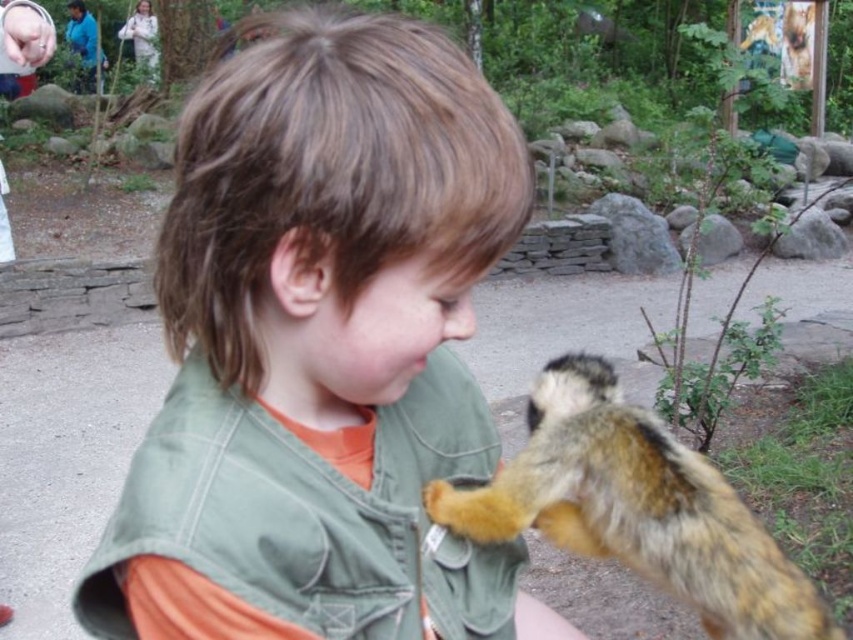
Does green fabric shirt at center appear under fuzzy brown squirrel at lower right?

Actually, green fabric shirt at center is above fuzzy brown squirrel at lower right.

Measure the distance between point (297, 129) and camera.

Point (297, 129) is 17.01 inches away from camera.

What do you see at coordinates (321, 348) in the screenshot? The width and height of the screenshot is (853, 640). I see `green fabric shirt at center` at bounding box center [321, 348].

Where is `green fabric shirt at center`? green fabric shirt at center is located at coordinates (321, 348).